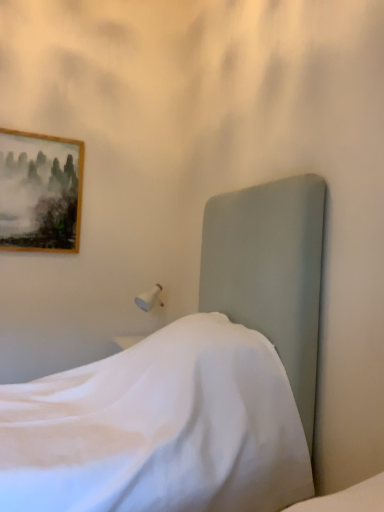
This screenshot has width=384, height=512. Identify the location of free space above wooden framed painting at upper left (from a real-world perspective). (46, 133).